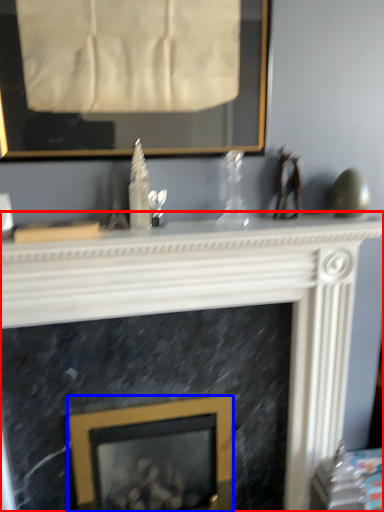
Question: Which of the following is the farthest to the observer, fireplace (highlighted by a red box) or picture frame (highlighted by a blue box)?

Choices:
 (A) fireplace
 (B) picture frame

Answer: (B)